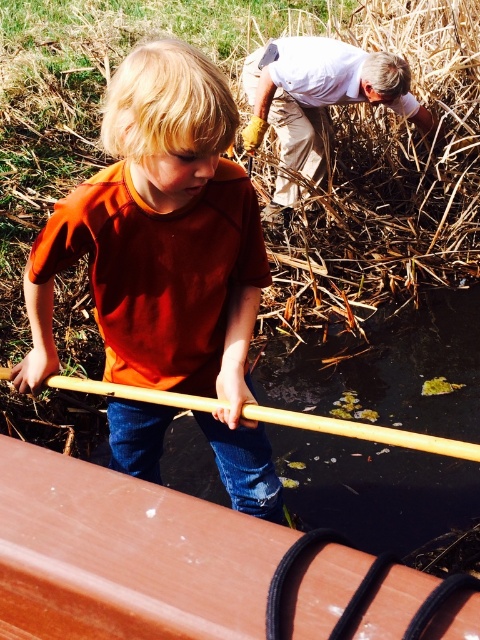
You are a photographer trying to capture a photo of the orange matte shirt at center and the brown wood canoe at lower left. Based on their sizes in the image, which object should you focus on first to ensure it appears larger in the photo?

The orange matte shirt at center is taller than the brown wood canoe at lower left, so you should focus on the orange matte shirt at center first to ensure it appears larger in the photo.

You are a photographer trying to capture a photo of the orange matte shirt at center and the brown wood canoe at lower left. Based on their positions, which object should you focus on first to ensure both are in frame?

The orange matte shirt at center is positioned over the brown wood canoe at lower left, so focusing on the orange matte shirt at center first will ensure both are in frame as the canoe is beneath it.